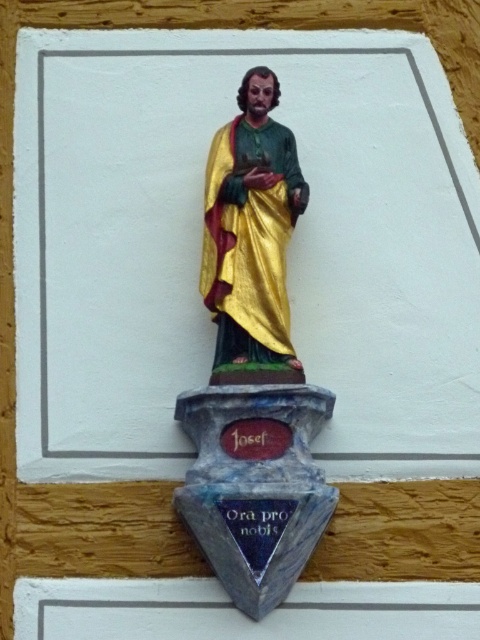
You are standing in front of the statue and want to touch the point at coordinates point (253, 340). Given that your arm can reach 1 meter, can you reach it?

The point (253, 340) is 79.12 meters away from the viewer, which is much farther than your arm can reach. You cannot reach it.